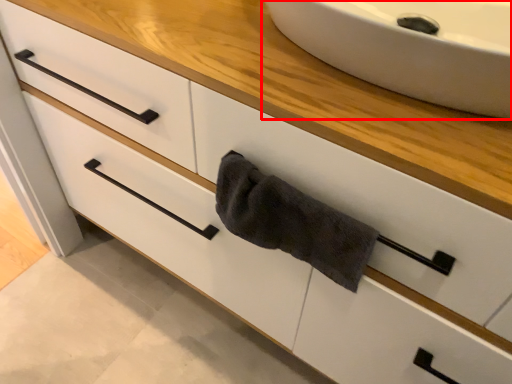
Question: From the image's perspective, where is sink (annotated by the red box) located in relation to bath towel in the image?

Choices:
 (A) below
 (B) above

Answer: (B)